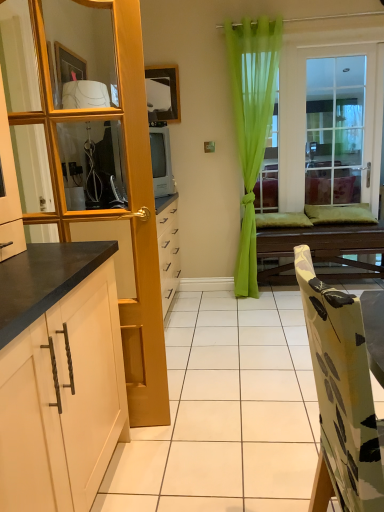
Question: Is clear glass window at center to the left or to the right of green sheer curtain at center in the image?

Choices:
 (A) left
 (B) right

Answer: (B)

Question: Looking at their shapes, would you say clear glass window at center is wider or thinner than green sheer curtain at center?

Choices:
 (A) thin
 (B) wide

Answer: (A)

Question: Which object is positioned farthest from the clear glass mirror at upper left?

Choices:
 (A) white matte cabinet at left
 (B) green sheer curtain at center
 (C) clear glass window at center
 (D) floral fabric chair at lower right
 (E) wooden table at center

Answer: (C)

Question: Based on their relative distances, which object is nearer to the clear glass mirror at upper left?

Choices:
 (A) green sheer curtain at center
 (B) clear glass window at center
 (C) white matte cabinet at left
 (D) wooden table at center
 (E) floral fabric chair at lower right

Answer: (C)